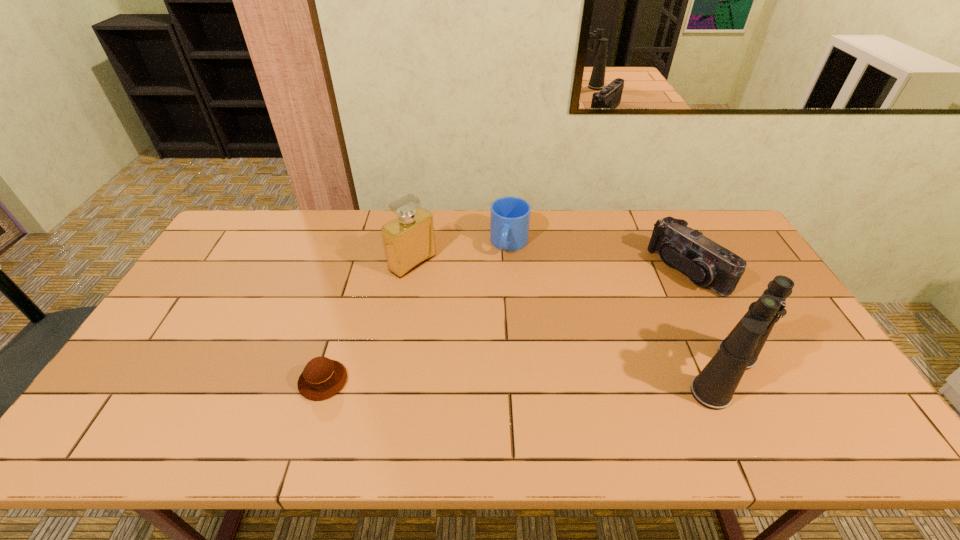
Find the location of a particular element. This screenshot has width=960, height=540. empty space between the third object from left to right and the leftmost object is located at coordinates (417, 312).

Identify which object is located as the second nearest to the camcorder. Please provide its 2D coordinates. Your answer should be formatted as a tuple, i.e. [(x, y)], where the tuple contains the x and y coordinates of a point satisfying the conditions above.

[(509, 216)]

Locate an element on the screen. The image size is (960, 540). object that is the fourth closest to the third object from right to left is located at coordinates (322, 378).

Where is `free point that satisfies the following two spatial constraints: 1. on the back side of the mug; 2. on the right side of the second object from left to right`? free point that satisfies the following two spatial constraints: 1. on the back side of the mug; 2. on the right side of the second object from left to right is located at coordinates (416, 244).

Image resolution: width=960 pixels, height=540 pixels. Find the location of `free space that satisfies the following two spatial constraints: 1. on the back side of the mug; 2. on the left side of the muffin`. free space that satisfies the following two spatial constraints: 1. on the back side of the mug; 2. on the left side of the muffin is located at coordinates (365, 244).

Locate an element on the screen. Image resolution: width=960 pixels, height=540 pixels. free space that satisfies the following two spatial constraints: 1. on the front side of the tallest object; 2. on the left side of the perfume is located at coordinates (395, 374).